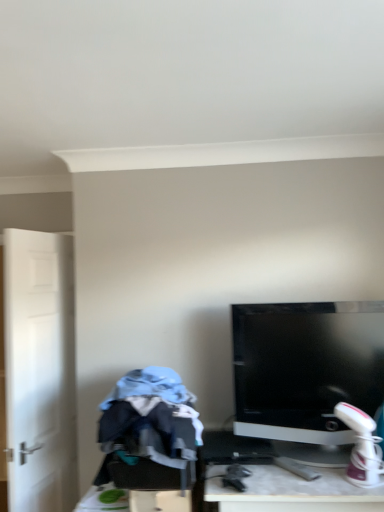
Question: Choose the correct answer: Is satin black monitor at center inside white matte door at left or outside it?

Choices:
 (A) outside
 (B) inside

Answer: (A)

Question: Is satin black monitor at center bigger or smaller than white matte door at left?

Choices:
 (A) big
 (B) small

Answer: (B)

Question: Considering the real-world distances, which object is closest to the satin black monitor at center?

Choices:
 (A) white matte door at left
 (B) blue cotton hoodie at left

Answer: (B)

Question: Considering the real-world distances, which object is closest to the white matte door at left?

Choices:
 (A) blue cotton hoodie at left
 (B) satin black monitor at center

Answer: (A)